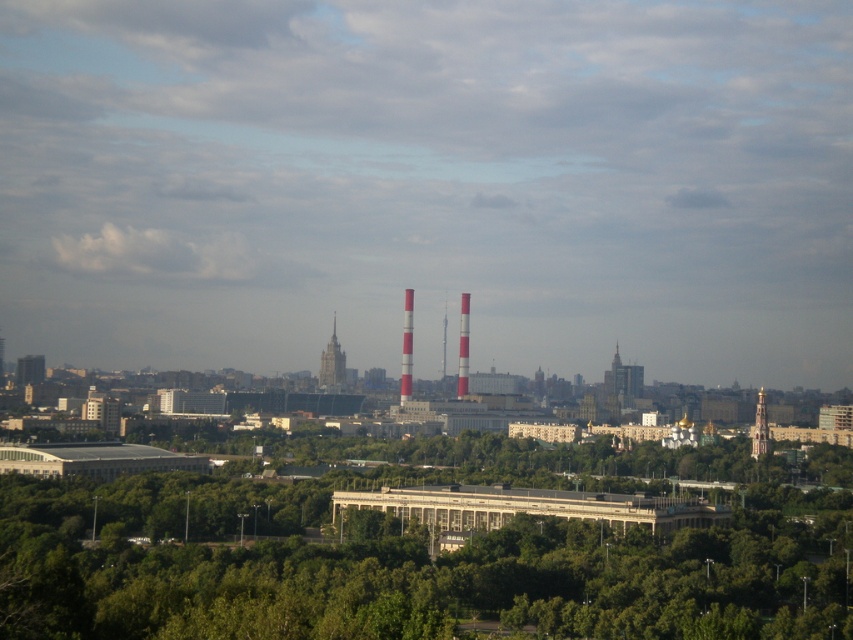
Who is positioned more to the right, red and white striped tower at center or gold textured tower at center-right?

Positioned to the right is gold textured tower at center-right.

The image size is (853, 640). What are the coordinates of `red and white striped tower at center` in the screenshot? It's located at (405, 348).

Identify the location of red and white striped tower at center. click(405, 348).

Does red and white striped tower at center appear on the right side of white striped tower at center?

In fact, red and white striped tower at center is to the left of white striped tower at center.

Is red and white striped tower at center below white striped tower at center?

Yes, red and white striped tower at center is below white striped tower at center.

Who is more distant from viewer, (405, 326) or (467, 369)?

Point (467, 369)

Identify the location of red and white striped tower at center. This screenshot has height=640, width=853. (405, 348).

The height and width of the screenshot is (640, 853). In order to click on gold textured dome at center in this screenshot , I will do tap(624, 380).

Does gold textured dome at center have a greater height compared to gold textured tower at center-right?

No, gold textured dome at center is not taller than gold textured tower at center-right.

Identify the location of gold textured dome at center. (624, 380).

Identify the location of gold textured dome at center. (624, 380).